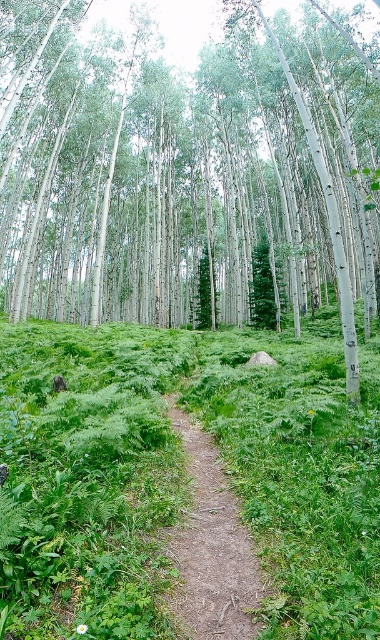
Which is more to the right, green leafy grass at center or dirt path at center?

From the viewer's perspective, dirt path at center appears more on the right side.

Consider the image. Does green leafy grass at center appear over dirt path at center?

Correct, green leafy grass at center is located above dirt path at center.

Which is in front, point (326, 464) or point (191, 426)?

Positioned in front is point (326, 464).

This screenshot has width=380, height=640. Find the location of `green leafy grass at center`. green leafy grass at center is located at coordinates (182, 472).

Who is higher up, white smooth tree at center or green leafy grass at center?

white smooth tree at center is above.

Between white smooth tree at center and green leafy grass at center, which one has less height?

Standing shorter between the two is green leafy grass at center.

Who is more distant from viewer, (115, 266) or (131, 596)?

The point (115, 266) is more distant.

Image resolution: width=380 pixels, height=640 pixels. I want to click on white smooth tree at center, so click(x=188, y=172).

Between point (300, 93) and point (178, 625), which one is positioned behind?

Point (300, 93)

Which is above, white smooth tree at center or dirt path at center?

Positioned higher is white smooth tree at center.

The image size is (380, 640). What are the coordinates of `white smooth tree at center` in the screenshot? It's located at (188, 172).